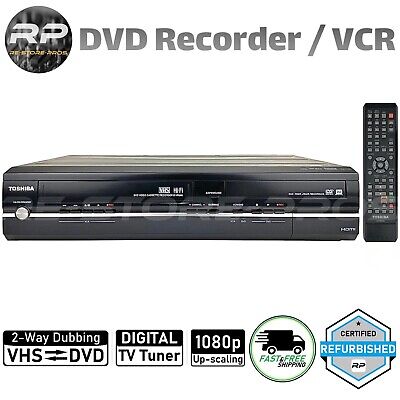
Image resolution: width=400 pixels, height=400 pixels. What are the coordinates of `vcr` in the screenshot? It's located at (200, 180).